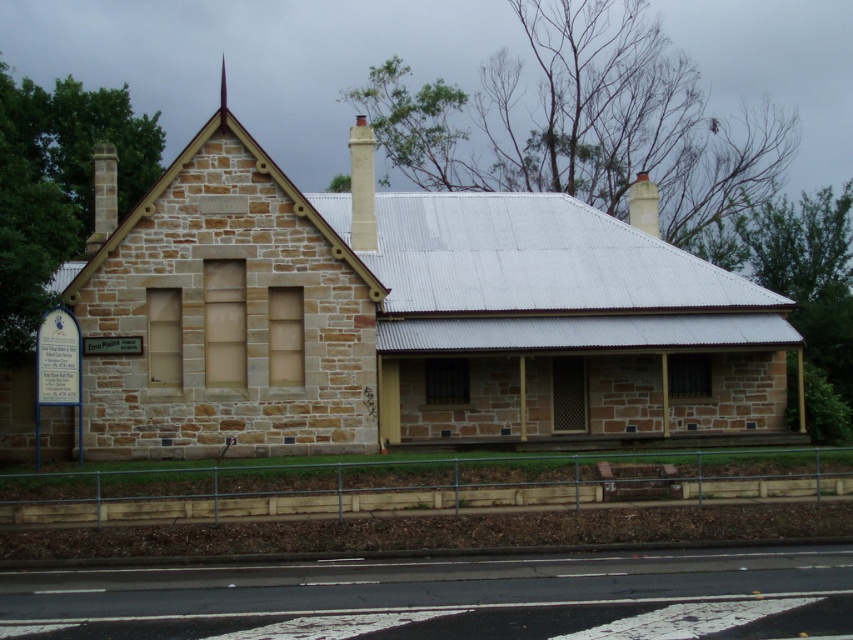
Question: Which of the following is the farthest from the observer?

Choices:
 (A) white stone chimney at upper center
 (B) white stone chimney at center
 (C) brown stone church at center

Answer: (A)

Question: Among these objects, which one is nearest to the camera?

Choices:
 (A) brown stone church at center
 (B) white stone chimney at upper center
 (C) white stone chimney at center

Answer: (A)

Question: Is white stone chimney at center positioned in front of white stone chimney at upper center?

Choices:
 (A) no
 (B) yes

Answer: (B)

Question: Which point appears farthest from the camera in this image?

Choices:
 (A) (643, 180)
 (B) (312, 285)
 (C) (363, 246)

Answer: (A)

Question: Is white stone chimney at center behind white stone chimney at upper center?

Choices:
 (A) yes
 (B) no

Answer: (B)

Question: Can you confirm if brown stone church at center is positioned to the left of white stone chimney at upper center?

Choices:
 (A) yes
 (B) no

Answer: (A)